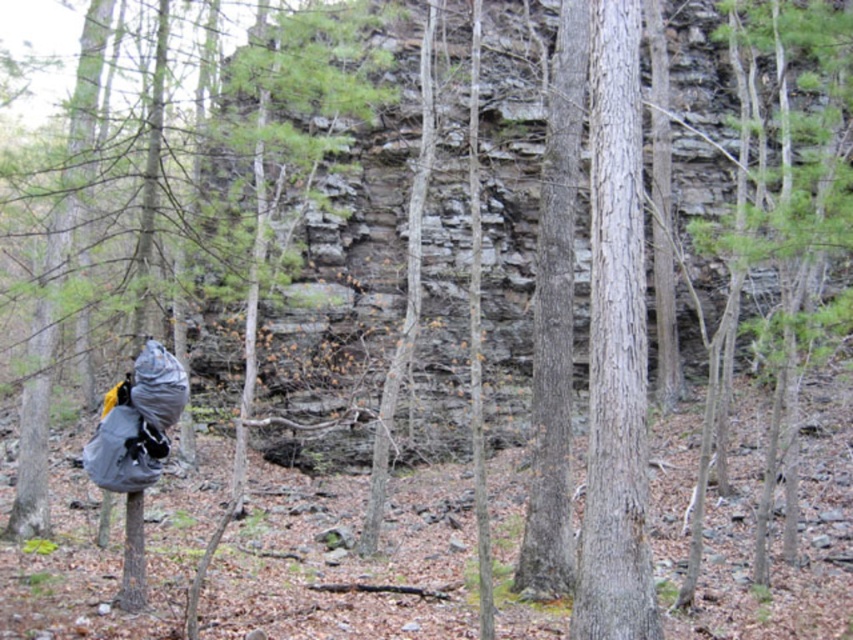
You are an ecologist studying tree bark textures in the forest. You notice two trees at the center of your view. Which tree is positioned to the left when observing the gray rough bark tree at center and the smooth bark tree at center?

The smooth bark tree at center is positioned to the left of the gray rough bark tree at center.

You are standing in the forest scene described. There is a point at coordinates (614, 348). What object is located at this point?

The point at coordinates (614, 348) corresponds to the gray rough bark tree at center.

You are an environmental scientist studying tree distribution in this forest. You observe the gray rough bark tree at center and the smooth bark tree at center. Which tree is closer to your current position?

The gray rough bark tree at center is closer to your current position because it is in front of the smooth bark tree at center.